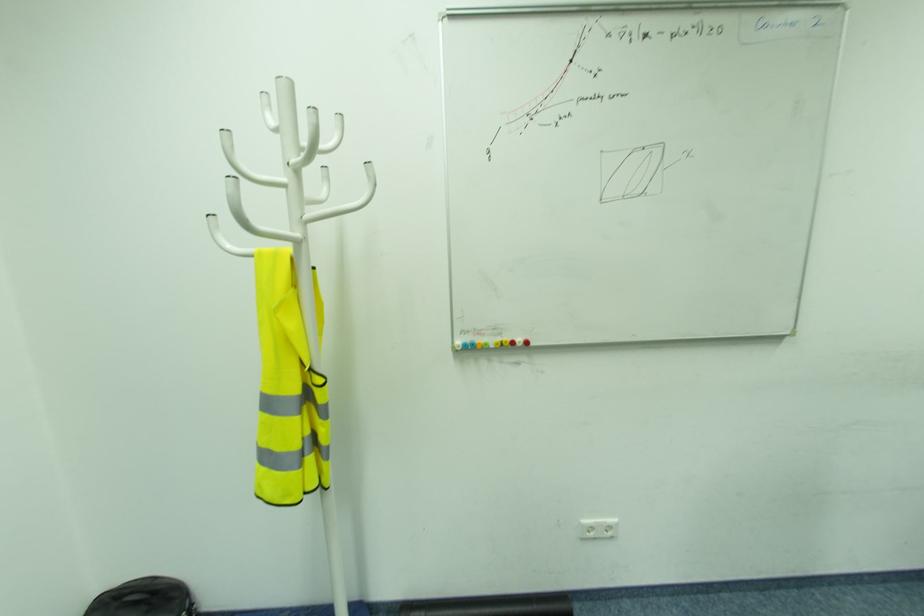
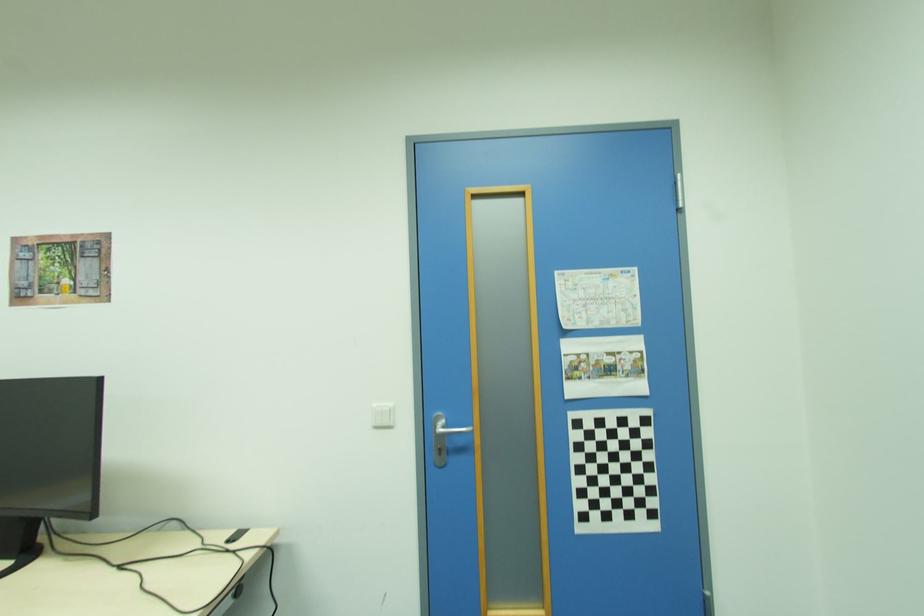
Question: The images are taken continuously from a first-person perspective. In which direction is your viewpoint rotating?

Choices:
 (A) Left
 (B) Right
 (C) Up
 (D) Down

Answer: (A)